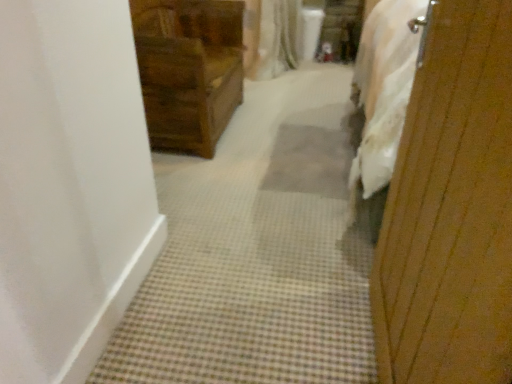
Question: Can you see wooden chest of drawers at upper left touching wooden screen door at right?

Choices:
 (A) no
 (B) yes

Answer: (A)

Question: Considering the relative positions of wooden chest of drawers at upper left and wooden screen door at right in the image provided, is wooden chest of drawers at upper left to the left of wooden screen door at right from the viewer's perspective?

Choices:
 (A) yes
 (B) no

Answer: (A)

Question: Is wooden chest of drawers at upper left facing towards wooden screen door at right?

Choices:
 (A) no
 (B) yes

Answer: (A)

Question: Is the depth of wooden chest of drawers at upper left greater than that of wooden screen door at right?

Choices:
 (A) no
 (B) yes

Answer: (B)

Question: Does wooden chest of drawers at upper left have a larger size compared to wooden screen door at right?

Choices:
 (A) no
 (B) yes

Answer: (B)

Question: Does wooden chest of drawers at upper left contain wooden screen door at right?

Choices:
 (A) no
 (B) yes

Answer: (A)

Question: From a real-world perspective, is wooden screen door at right below wooden chest of drawers at upper left?

Choices:
 (A) yes
 (B) no

Answer: (B)

Question: Can you confirm if wooden screen door at right is thinner than wooden chest of drawers at upper left?

Choices:
 (A) yes
 (B) no

Answer: (A)

Question: Is wooden screen door at right positioned before wooden chest of drawers at upper left?

Choices:
 (A) no
 (B) yes

Answer: (B)

Question: Is wooden screen door at right shorter than wooden chest of drawers at upper left?

Choices:
 (A) no
 (B) yes

Answer: (A)

Question: Does wooden screen door at right appear on the left side of wooden chest of drawers at upper left?

Choices:
 (A) no
 (B) yes

Answer: (A)

Question: Can you confirm if wooden screen door at right is wider than wooden chest of drawers at upper left?

Choices:
 (A) yes
 (B) no

Answer: (B)

Question: In the image, is wooden chest of drawers at upper left on the left side or the right side of wooden screen door at right?

Choices:
 (A) right
 (B) left

Answer: (B)